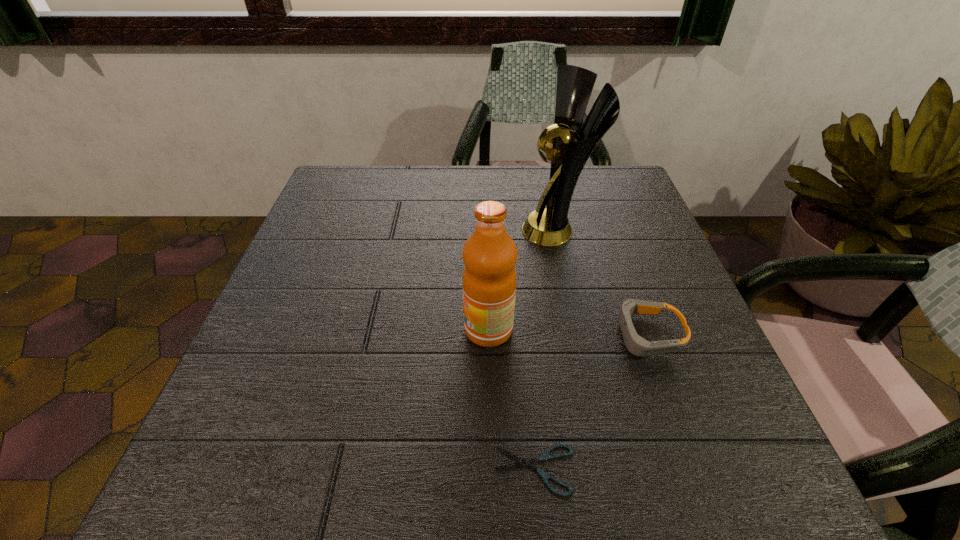
The image size is (960, 540). I want to click on vacant space located 0.310m on the label side of the second tallest object, so click(295, 329).

Locate an element on the screen. vacant position located 0.090m on the label side of the second tallest object is located at coordinates 415,329.

The height and width of the screenshot is (540, 960). In order to click on vacant space located on the front and back of the goggles in this screenshot , I will do `click(428, 334)`.

This screenshot has width=960, height=540. Find the location of `free space located on the front and back of the goggles`. free space located on the front and back of the goggles is located at coordinates (567, 334).

Find the location of a particular element. free space located on the front and back of the goggles is located at coordinates (495, 334).

Image resolution: width=960 pixels, height=540 pixels. What are the coordinates of `vacant space situated 0.220m on the back of the shears` in the screenshot? It's located at (522, 329).

The height and width of the screenshot is (540, 960). What are the coordinates of `object that is at the far edge` in the screenshot? It's located at (550, 226).

I want to click on object situated at the near edge, so click(x=545, y=476).

Locate an element on the screen. award positioned at the right edge is located at coordinates tap(550, 226).

Identify the location of goggles that is positioned at the right edge. (638, 346).